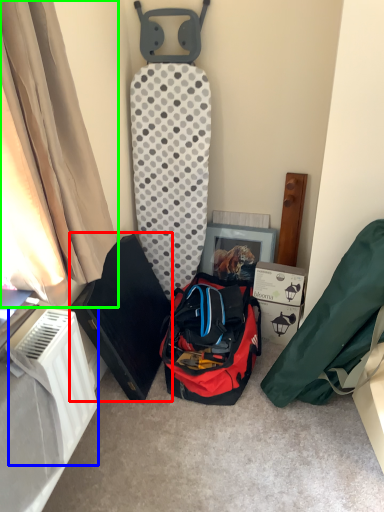
Question: Which object is the farthest from kit (highlighted by a red box)? Choose among these: radiator (highlighted by a blue box) or curtain (highlighted by a green box).

Choices:
 (A) radiator
 (B) curtain

Answer: (B)